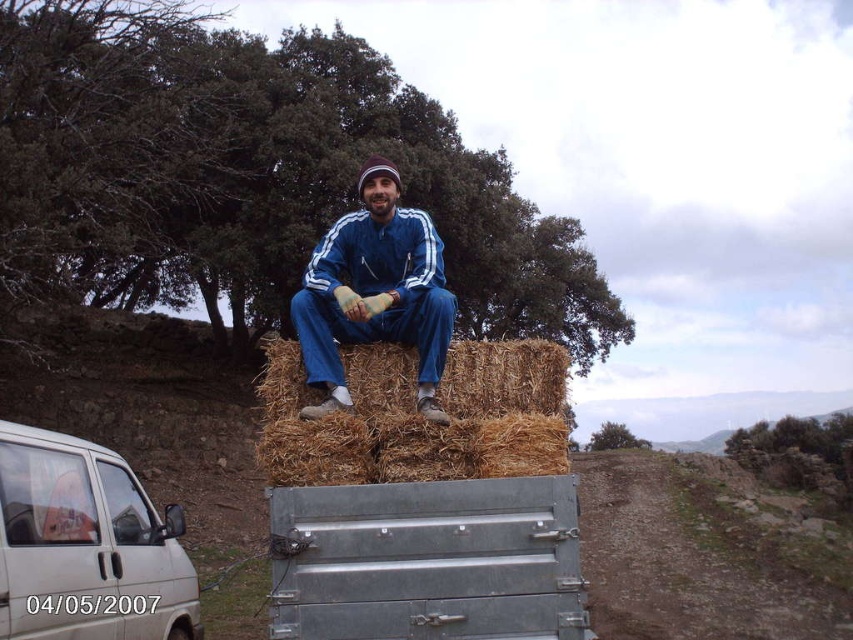
Question: Which object appears farthest from the camera in this image?

Choices:
 (A) blue fabric pants at center
 (B) galvanized metal crate at center
 (C) brown straw bale at upper center
 (D) white matte van at lower left

Answer: (A)

Question: Observing the image, what is the correct spatial positioning of galvanized metal crate at center in reference to blue fabric pants at center?

Choices:
 (A) left
 (B) right

Answer: (B)

Question: Which point is farther to the camera?

Choices:
 (A) (379, 333)
 (B) (390, 524)
 (C) (196, 624)
 (D) (305, 444)

Answer: (C)

Question: Among these objects, which one is nearest to the camera?

Choices:
 (A) brown straw bale at upper center
 (B) blue fabric pants at center
 (C) galvanized metal crate at center

Answer: (C)

Question: Where is galvanized metal crate at center located in relation to blue fabric pants at center in the image?

Choices:
 (A) below
 (B) above

Answer: (A)

Question: Is galvanized metal crate at center positioned at the back of brown straw bale at upper center?

Choices:
 (A) yes
 (B) no

Answer: (B)